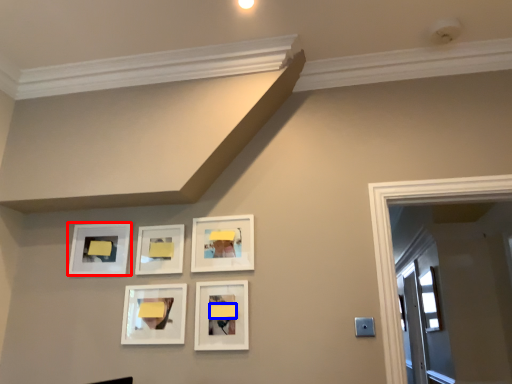
Question: Which of the following is the closest to the observer, picture frame (highlighted by a red box) or lift (highlighted by a blue box)?

Choices:
 (A) picture frame
 (B) lift

Answer: (B)